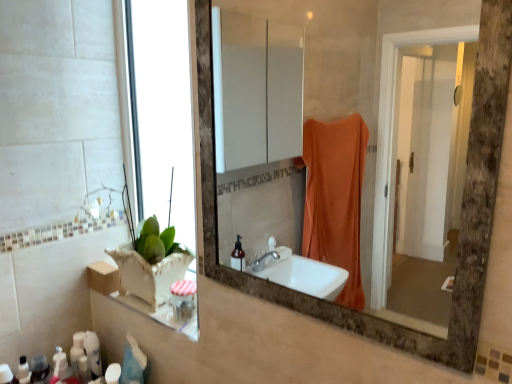
Question: Is white matte bottle at lower left, placed as the 2th toiletry when sorted from left to right, to the left of matte brown mirror at center from the viewer's perspective?

Choices:
 (A) no
 (B) yes

Answer: (B)

Question: Is white matte bottle at lower left, positioned as the 1th toiletry in right-to-left order, outside matte brown mirror at center?

Choices:
 (A) yes
 (B) no

Answer: (A)

Question: Does white matte bottle at lower left, placed as the 2th toiletry when sorted from left to right, have a lesser width compared to matte brown mirror at center?

Choices:
 (A) no
 (B) yes

Answer: (A)

Question: Is white matte bottle at lower left, positioned as the 1th toiletry in right-to-left order, closer to the viewer compared to matte brown mirror at center?

Choices:
 (A) no
 (B) yes

Answer: (A)

Question: Can you confirm if white matte bottle at lower left, positioned as the 1th toiletry in right-to-left order, is positioned to the right of matte brown mirror at center?

Choices:
 (A) no
 (B) yes

Answer: (A)

Question: Is white matte bottle at lower left, placed as the 2th toiletry when sorted from left to right, to the left or to the right of matte brown mirror at center in the image?

Choices:
 (A) left
 (B) right

Answer: (A)

Question: Does point (105, 382) appear closer or farther from the camera than point (417, 180)?

Choices:
 (A) farther
 (B) closer

Answer: (B)

Question: From the image's perspective, is white matte bottle at lower left, placed as the 2th toiletry when sorted from left to right, above or below matte brown mirror at center?

Choices:
 (A) above
 (B) below

Answer: (B)

Question: Is white matte bottle at lower left, placed as the 2th toiletry when sorted from left to right, taller or shorter than matte brown mirror at center?

Choices:
 (A) tall
 (B) short

Answer: (B)

Question: From the image's perspective, is matte white lotion at lower left, the 2th toiletry from the right, positioned above or below white matte bottle at lower left, placed as the 2th toiletry when sorted from left to right?

Choices:
 (A) above
 (B) below

Answer: (A)

Question: From a real-world perspective, relative to white matte bottle at lower left, placed as the 2th toiletry when sorted from left to right, is matte white lotion at lower left, the 2th toiletry from the right, vertically above or below?

Choices:
 (A) above
 (B) below

Answer: (B)

Question: Choose the correct answer: Is matte white lotion at lower left, the 2th toiletry from the right, inside white matte bottle at lower left, positioned as the 1th toiletry in right-to-left order, or outside it?

Choices:
 (A) outside
 (B) inside

Answer: (A)

Question: Is point (27, 367) closer or farther from the camera than point (112, 367)?

Choices:
 (A) closer
 (B) farther

Answer: (A)

Question: Considering the positions of point (358, 109) and point (115, 365), is point (358, 109) closer or farther from the camera than point (115, 365)?

Choices:
 (A) closer
 (B) farther

Answer: (B)

Question: Is matte brown mirror at center taller or shorter than white matte bottle at lower left, placed as the 2th toiletry when sorted from left to right?

Choices:
 (A) tall
 (B) short

Answer: (A)